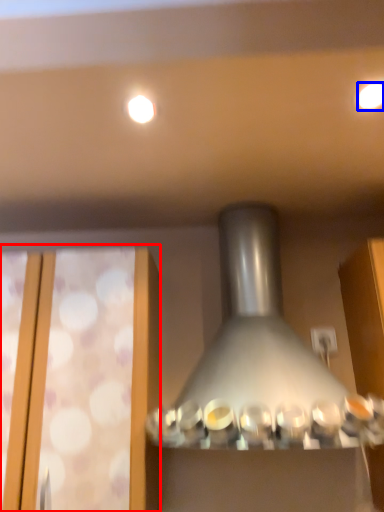
Question: Which object appears farthest to the camera in this image, glass door (highlighted by a red box) or lighting (highlighted by a blue box)?

Choices:
 (A) glass door
 (B) lighting

Answer: (A)